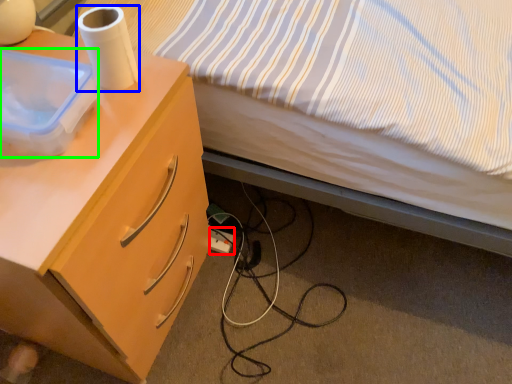
Question: Estimate the real-world distances between objects in this image. Which object is closer to power outlet (highlighted by a red box), paper towel (highlighted by a blue box) or box (highlighted by a green box)?

Choices:
 (A) paper towel
 (B) box

Answer: (A)